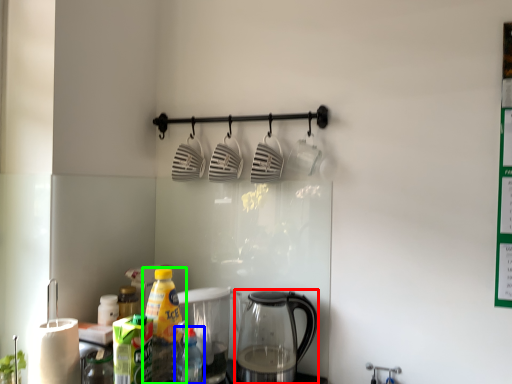
Question: Based on their relative distances, which object is nearer to kettle (highlighted by a red box)? Choose from bottle (highlighted by a blue box) and bottle (highlighted by a green box).

Choices:
 (A) bottle
 (B) bottle

Answer: (A)